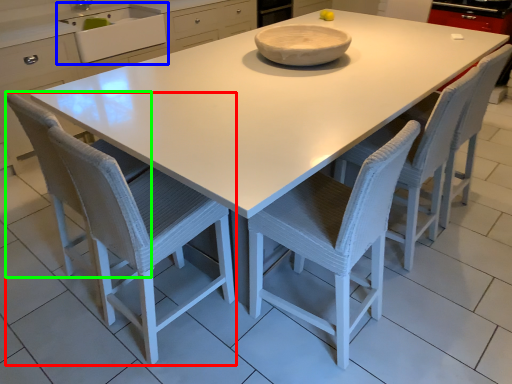
Question: Based on their relative distances, which object is farther from chair (highlighted by a red box)? Choose from sink (highlighted by a blue box) and swivel chair (highlighted by a green box).

Choices:
 (A) sink
 (B) swivel chair

Answer: (A)